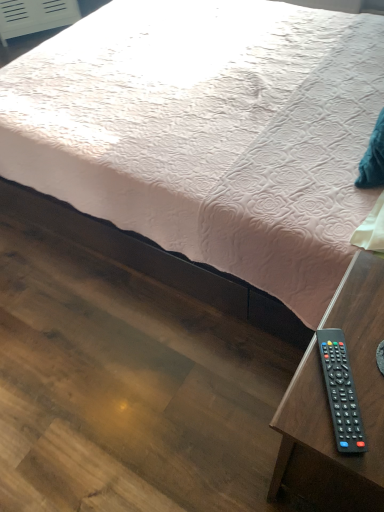
Question: Is black plastic remote at lower right inside black plastic remote at lower right?

Choices:
 (A) no
 (B) yes

Answer: (A)

Question: Considering the relative sizes of black plastic remote at lower right and black plastic remote at lower right in the image provided, is black plastic remote at lower right thinner than black plastic remote at lower right?

Choices:
 (A) yes
 (B) no

Answer: (B)

Question: Is black plastic remote at lower right facing towards black plastic remote at lower right?

Choices:
 (A) no
 (B) yes

Answer: (A)

Question: Can you confirm if black plastic remote at lower right is shorter than black plastic remote at lower right?

Choices:
 (A) no
 (B) yes

Answer: (A)

Question: Is black plastic remote at lower right smaller than black plastic remote at lower right?

Choices:
 (A) no
 (B) yes

Answer: (A)

Question: Is black plastic remote at lower right at the left side of black plastic remote at lower right?

Choices:
 (A) no
 (B) yes

Answer: (A)

Question: Considering the relative positions of black plastic remote at lower right and pink quilted fabric at center in the image provided, is black plastic remote at lower right behind pink quilted fabric at center?

Choices:
 (A) yes
 (B) no

Answer: (B)

Question: Does black plastic remote at lower right turn towards pink quilted fabric at center?

Choices:
 (A) yes
 (B) no

Answer: (B)

Question: From the image's perspective, would you say black plastic remote at lower right is positioned over pink quilted fabric at center?

Choices:
 (A) yes
 (B) no

Answer: (B)

Question: Could pink quilted fabric at center be considered to be inside black plastic remote at lower right?

Choices:
 (A) yes
 (B) no

Answer: (B)

Question: Does black plastic remote at lower right touch pink quilted fabric at center?

Choices:
 (A) no
 (B) yes

Answer: (A)

Question: From a real-world perspective, does black plastic remote at lower right sit lower than pink quilted fabric at center?

Choices:
 (A) yes
 (B) no

Answer: (A)

Question: Considering the relative sizes of pink quilted fabric at center and black plastic remote at lower right in the image provided, is pink quilted fabric at center wider than black plastic remote at lower right?

Choices:
 (A) yes
 (B) no

Answer: (A)